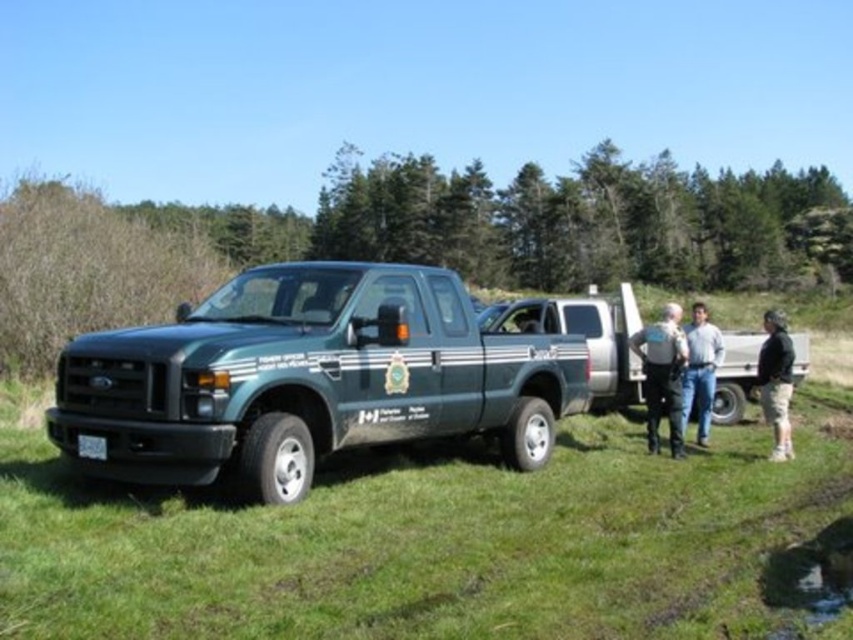
Is green matte truck at left closer to the viewer compared to dark gray uniform at center?

That is True.

Locate an element on the screen. green matte truck at left is located at coordinates (308, 380).

Locate an element on the screen. green matte truck at left is located at coordinates click(308, 380).

Does silver metallic pickup truck at center lie behind black cotton pants at lower right?

No, silver metallic pickup truck at center is closer to the viewer.

Who is higher up, silver metallic pickup truck at center or black cotton pants at lower right?

silver metallic pickup truck at center is higher up.

Does point (525, 326) come farther from viewer compared to point (779, 456)?

Yes, point (525, 326) is behind point (779, 456).

Identify the location of silver metallic pickup truck at center. The width and height of the screenshot is (853, 640). (583, 336).

Who is taller, green grass at lower left or silver metallic pickup truck at center?

silver metallic pickup truck at center

Is green grass at lower left smaller than silver metallic pickup truck at center?

Yes, green grass at lower left is smaller than silver metallic pickup truck at center.

Between point (788, 536) and point (595, 352), which one is positioned behind?

Positioned behind is point (595, 352).

This screenshot has height=640, width=853. Identify the location of green grass at lower left. (445, 541).